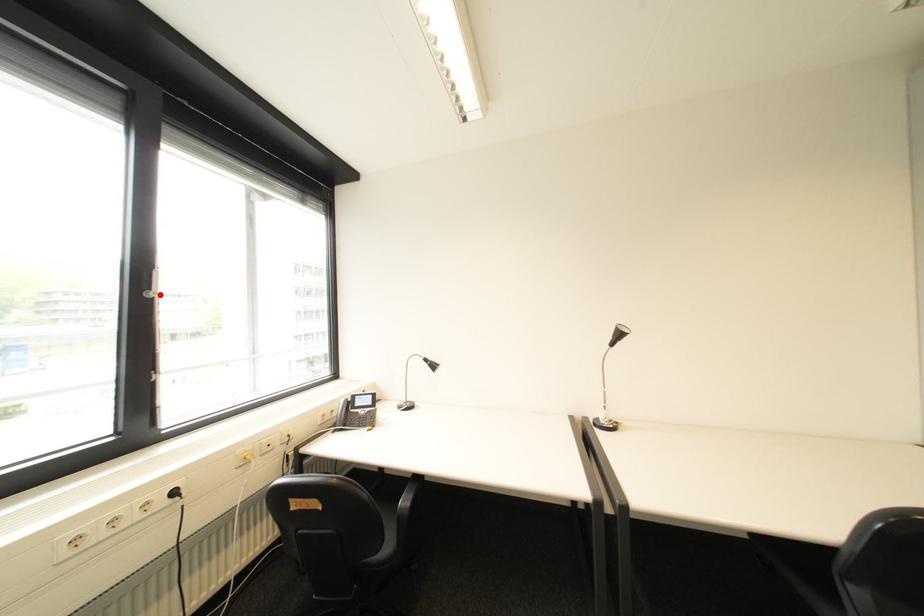
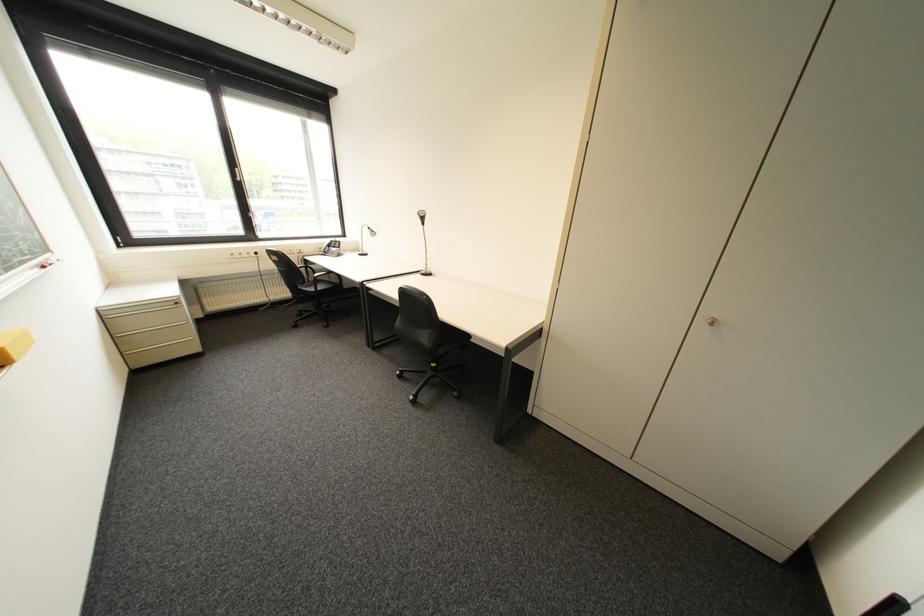
Question: I am providing you with two images of the same scene from different viewpoints. In image1, a red point is highlighted. Considering the same 3D point in image2, which of the following is correct?

Choices:
 (A) It is closer
 (B) It is farther

Answer: (A)